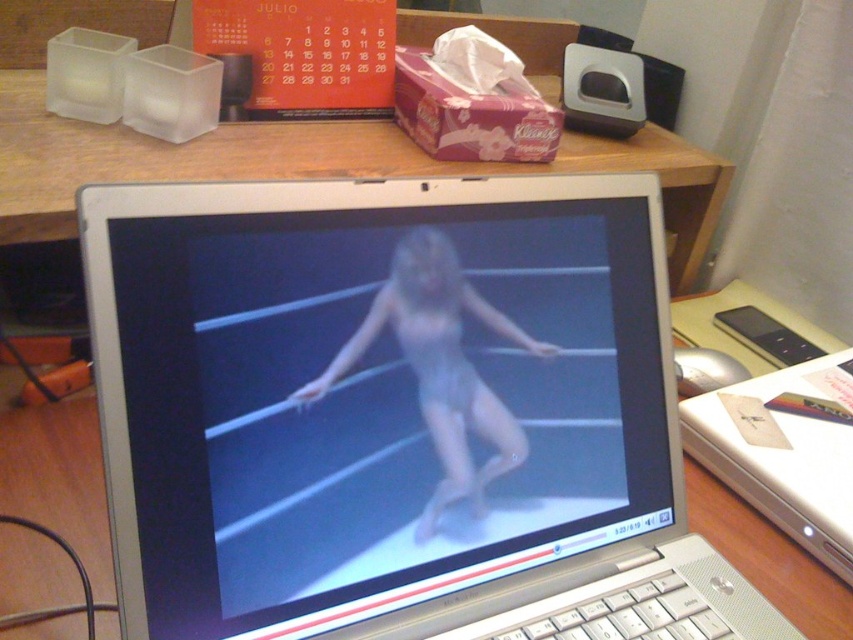
Question: Is silver metallic laptop at center closer to the viewer compared to white plastic mouse at right?

Choices:
 (A) no
 (B) yes

Answer: (B)

Question: Which point is closer to the camera?

Choices:
 (A) silver metallic laptop at center
 (B) white plastic mouse at right

Answer: (A)

Question: Can you confirm if smooth skin woman at center is positioned to the left of white plastic mouse at right?

Choices:
 (A) no
 (B) yes

Answer: (B)

Question: Which object is farther from the camera taking this photo?

Choices:
 (A) white plastic mouse at right
 (B) smooth skin woman at center

Answer: (A)

Question: Is silver metallic laptop at center below smooth skin woman at center?

Choices:
 (A) yes
 (B) no

Answer: (A)

Question: Which point is farther to the camera?

Choices:
 (A) (505, 419)
 (B) (502, 556)
 (C) (842, 502)

Answer: (C)